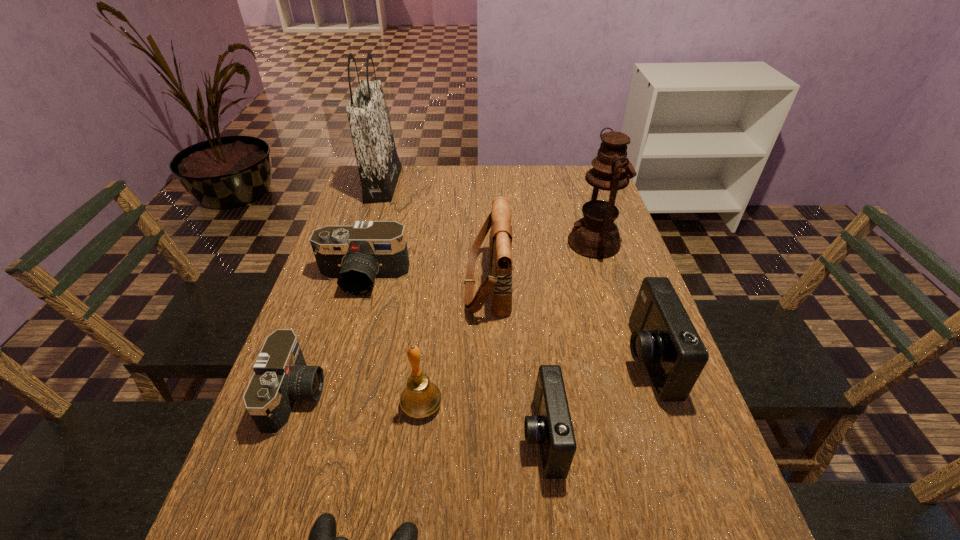
Locate an element on the screen. Image resolution: width=960 pixels, height=540 pixels. the second camera from right to left is located at coordinates click(551, 426).

Where is `the nearer black camera`? This screenshot has height=540, width=960. the nearer black camera is located at coordinates (281, 377).

This screenshot has width=960, height=540. What are the coordinates of `vacant space located on the front of the shopping bag with the design` in the screenshot? It's located at (440, 184).

Locate an element on the screen. This screenshot has height=540, width=960. vacant point located 0.120m on the left of the oil lamp is located at coordinates (528, 243).

Where is `free location located 0.140m on the front-facing side of the shoulder bag`? The image size is (960, 540). free location located 0.140m on the front-facing side of the shoulder bag is located at coordinates (412, 285).

Find the location of `vacant region located 0.080m on the front-facing side of the shoulder bag`. vacant region located 0.080m on the front-facing side of the shoulder bag is located at coordinates (435, 285).

Find the location of a particular element. free space located 0.080m on the front-facing side of the shoulder bag is located at coordinates (435, 285).

Identify the location of free spot located on the back of the bell. (435, 288).

Image resolution: width=960 pixels, height=540 pixels. I want to click on vacant space located on the front-facing side of the rightmost camera, so click(x=473, y=360).

You are a GUI agent. You are given a task and a screenshot of the screen. Output one action in this format:
    pyautogui.click(x=<x>, y=<y>)
    Task: Click on the free point located on the front-facing side of the rightmost camera
    This screenshot has width=960, height=540.
    Given the screenshot: What is the action you would take?
    pyautogui.click(x=584, y=360)